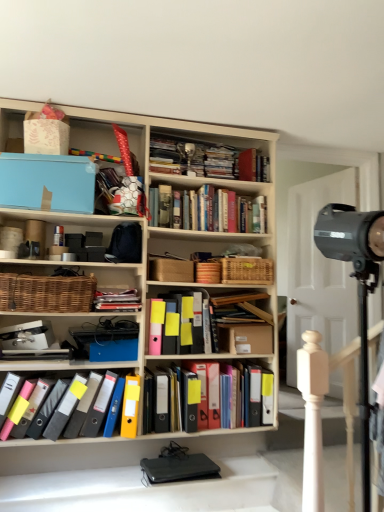
Question: Looking at their shapes, would you say woven brown basket at left is wider or thinner than woven brown basket at center?

Choices:
 (A) thin
 (B) wide

Answer: (B)

Question: In the image, is woven brown basket at left on the left side or the right side of woven brown basket at center?

Choices:
 (A) left
 (B) right

Answer: (A)

Question: Which is nearer to the matte black folders at center, the third book in the bottom-to-top sequence?

Choices:
 (A) multicolored plastic binders at center, marked as the first book in a bottom-to-top arrangement
 (B) matte plastic folders at lower left, the 3th book positioned from the top
 (C) woven brown basket at left
 (D) black metallic spotlight at right
 (E) black plastic wallet at lower center

Answer: (C)

Question: Which is nearer to the black plastic wallet at lower center?

Choices:
 (A) matte plastic folders at lower left, acting as the second book starting from the bottom
 (B) multicolored plastic binders at center, the fourth book from the top
 (C) black metallic spotlight at right
 (D) hardcover books at center, marked as the fourth book in a bottom-to-top arrangement
 (E) matte black folders at center, the third book in the bottom-to-top sequence

Answer: (A)